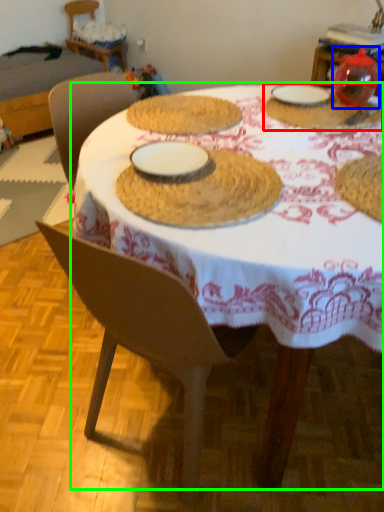
Question: Estimate the real-world distances between objects in this image. Which object is farther from tableware (highlighted by a red box), tableware (highlighted by a blue box) or table (highlighted by a green box)?

Choices:
 (A) tableware
 (B) table

Answer: (B)